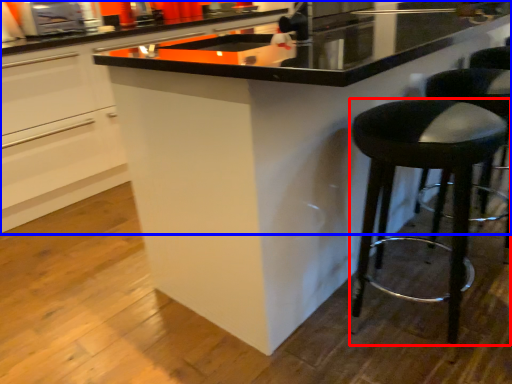
Question: Which of the following is the farthest to the observer, stool (highlighted by a red box) or cabinetry (highlighted by a blue box)?

Choices:
 (A) stool
 (B) cabinetry

Answer: (B)